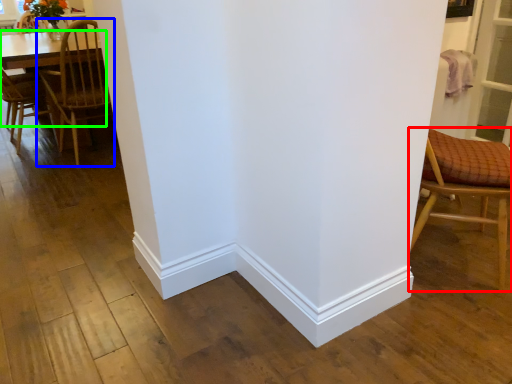
Question: Based on their relative distances, which object is nearer to chair (highlighted by a red box)? Choose from chair (highlighted by a blue box) and table (highlighted by a green box).

Choices:
 (A) chair
 (B) table

Answer: (A)